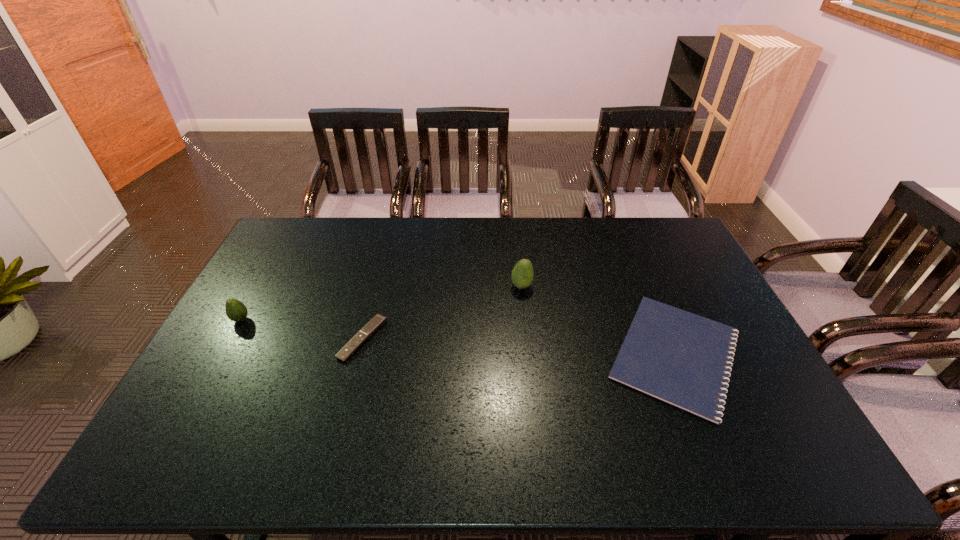
What are the coordinates of `free space located on the left of the remote control` in the screenshot? It's located at (239, 339).

Find the location of a particular element. This screenshot has width=960, height=540. free spot located 0.300m on the left of the shortest object is located at coordinates (495, 354).

This screenshot has height=540, width=960. In order to click on object located in the left edge section of the desktop in this screenshot , I will do `click(236, 311)`.

Where is `object at the right edge`? This screenshot has width=960, height=540. object at the right edge is located at coordinates (683, 359).

What are the coordinates of `free space at the far edge of the desktop` in the screenshot? It's located at (599, 237).

I want to click on vacant space at the near edge of the desktop, so click(x=729, y=456).

This screenshot has height=540, width=960. In the image, there is a desktop. In order to click on vacant space at the right edge in this screenshot , I will do 684,284.

You are a GUI agent. You are given a task and a screenshot of the screen. Output one action in this format:
    pyautogui.click(x=<x>, y=<y>)
    Task: Click on the vacant space at the near left corner of the desktop
    This screenshot has width=960, height=540.
    Given the screenshot: What is the action you would take?
    pyautogui.click(x=199, y=450)

Image resolution: width=960 pixels, height=540 pixels. I want to click on vacant space that's between the notepad and the shorter avocado, so click(458, 337).

Locate an element on the screen. This screenshot has height=540, width=960. vacant space in between the third tallest object and the nearer avocado is located at coordinates coord(301,329).